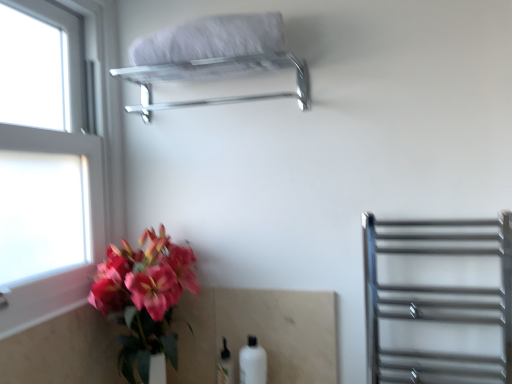
Question: Does white matte bottle at lower center, the 2th bottle positioned from the right, lie in front of white fluffy towel at upper center?

Choices:
 (A) no
 (B) yes

Answer: (A)

Question: Considering the relative positions of white matte bottle at lower center, the 2th bottle positioned from the right, and white fluffy towel at upper center in the image provided, is white matte bottle at lower center, the 2th bottle positioned from the right, to the right of white fluffy towel at upper center from the viewer's perspective?

Choices:
 (A) yes
 (B) no

Answer: (A)

Question: Does white matte bottle at lower center, which ranks as the first bottle in left-to-right order, have a smaller size compared to white fluffy towel at upper center?

Choices:
 (A) no
 (B) yes

Answer: (B)

Question: Considering the relative sizes of white matte bottle at lower center, the 2th bottle positioned from the right, and white fluffy towel at upper center in the image provided, is white matte bottle at lower center, the 2th bottle positioned from the right, wider than white fluffy towel at upper center?

Choices:
 (A) no
 (B) yes

Answer: (A)

Question: Is white matte bottle at lower center, the 2th bottle positioned from the right, bigger than white fluffy towel at upper center?

Choices:
 (A) yes
 (B) no

Answer: (B)

Question: Does white matte bottle at lower center, the 2th bottle positioned from the right, touch white fluffy towel at upper center?

Choices:
 (A) no
 (B) yes

Answer: (A)

Question: Can you confirm if white glass window at left is positioned to the left of polished chrome towel rack at right?

Choices:
 (A) yes
 (B) no

Answer: (A)

Question: Is white glass window at left taller than polished chrome towel rack at right?

Choices:
 (A) no
 (B) yes

Answer: (B)

Question: Would you consider white glass window at left to be distant from polished chrome towel rack at right?

Choices:
 (A) yes
 (B) no

Answer: (A)

Question: Is white glass window at left turned away from polished chrome towel rack at right?

Choices:
 (A) no
 (B) yes

Answer: (A)

Question: Can you confirm if white glass window at left is positioned to the right of polished chrome towel rack at right?

Choices:
 (A) no
 (B) yes

Answer: (A)

Question: Is white glass window at left facing towards polished chrome towel rack at right?

Choices:
 (A) no
 (B) yes

Answer: (B)

Question: Is polished chrome towel rack at upper center facing towards white glass window at left?

Choices:
 (A) yes
 (B) no

Answer: (B)